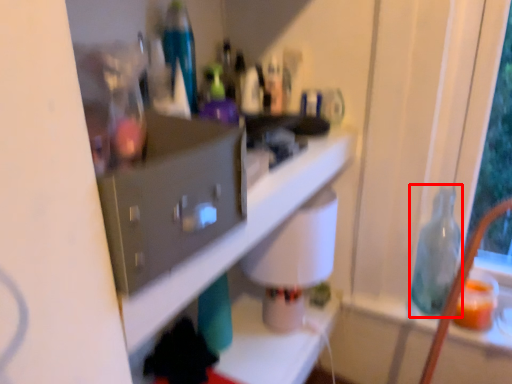
Question: Where is bottle (annotated by the red box) located in relation to shelf in the image?

Choices:
 (A) right
 (B) left

Answer: (A)